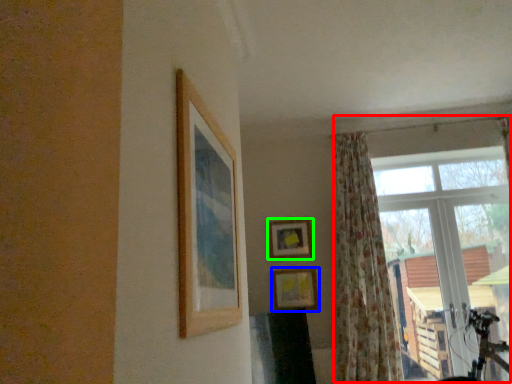
Question: Which object is positioned closest to window (highlighted by a red box)? Select from picture frame (highlighted by a blue box) and picture frame (highlighted by a green box).

Choices:
 (A) picture frame
 (B) picture frame

Answer: (B)